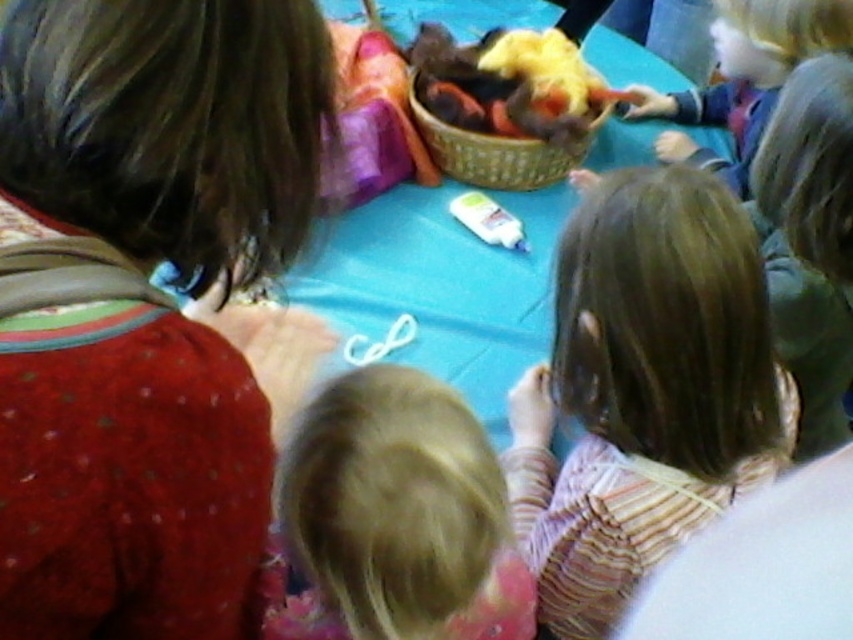
You are a child sitting at the table and need to reach for the white glossy glue at center. Which direction should you move your hand to get it from the brown woven basket at center?

The brown woven basket at center is positioned on the right side of white glossy glue at center, so you should move your hand to the left to reach the white glossy glue at center.

You are observing a group of children sitting around a table in a classroom. You notice two children with light brown hair at center and blonde hair at center. Which child has hair that appears bigger in size?

The light brown hair at center has a larger size compared to the blonde hair at center, so the child with light brown hair at center has hair that appears bigger in size.